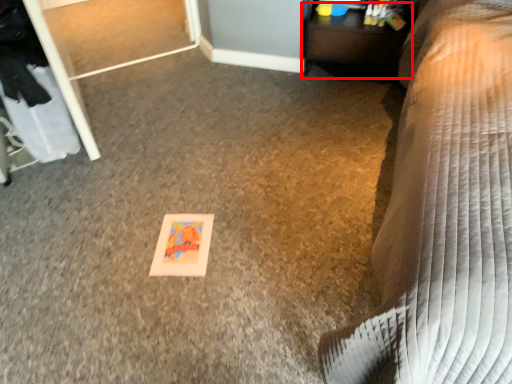
Question: From the image's perspective, where is table (annotated by the red box) located relative to furniture?

Choices:
 (A) above
 (B) below

Answer: (A)